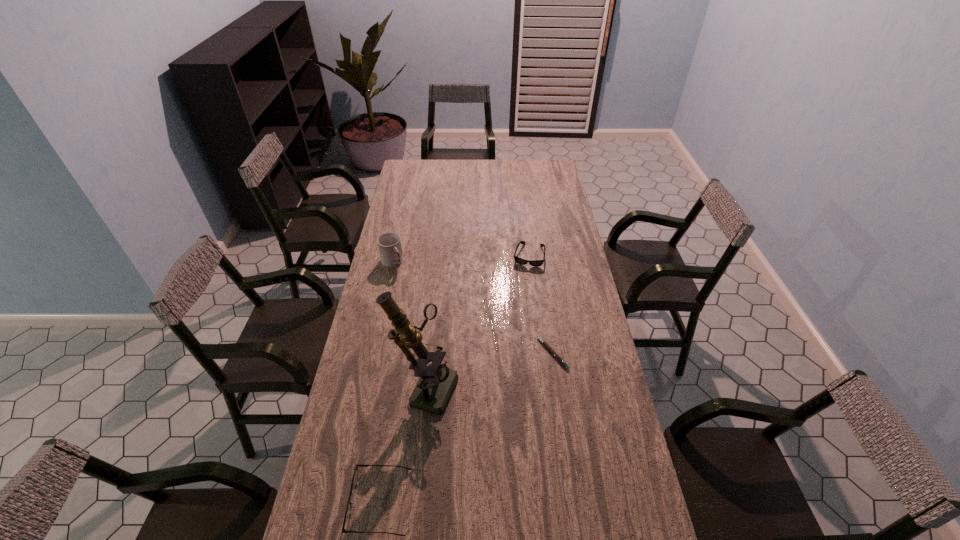
The width and height of the screenshot is (960, 540). Identify the location of free space that satisfies the following two spatial constraints: 1. on the front side of the fourth shortest object; 2. on the front-facing side of the nearest object. (339, 502).